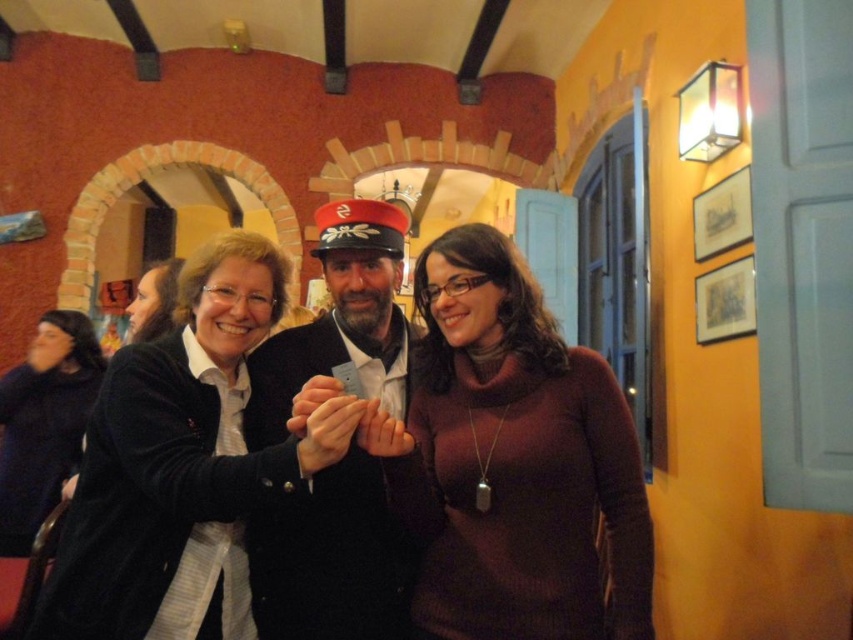
Who is lower down, burgundy sweater at center or matte black jacket at center?

burgundy sweater at center

This screenshot has width=853, height=640. I want to click on burgundy sweater at center, so click(515, 461).

Identify the location of burgundy sweater at center. (515, 461).

Find the location of a particular element. burgundy sweater at center is located at coordinates (515, 461).

Which of these two, burgundy sweater at center or dark blue sweater at left, stands shorter?

burgundy sweater at center

Between burgundy sweater at center and dark blue sweater at left, which one has more height?

With more height is dark blue sweater at left.

This screenshot has height=640, width=853. Identify the location of burgundy sweater at center. (515, 461).

Locate an element on the screen. burgundy sweater at center is located at coordinates (515, 461).

Between matte black cardigan at center and dark blue sweater at left, which one is positioned higher?

matte black cardigan at center is above.

Image resolution: width=853 pixels, height=640 pixels. What do you see at coordinates (245, 496) in the screenshot? I see `matte black cardigan at center` at bounding box center [245, 496].

Is point (364, 515) farther from viewer compared to point (74, 310)?

No, (364, 515) is in front of (74, 310).

The image size is (853, 640). What are the coordinates of `matte black cardigan at center` in the screenshot? It's located at (x=245, y=496).